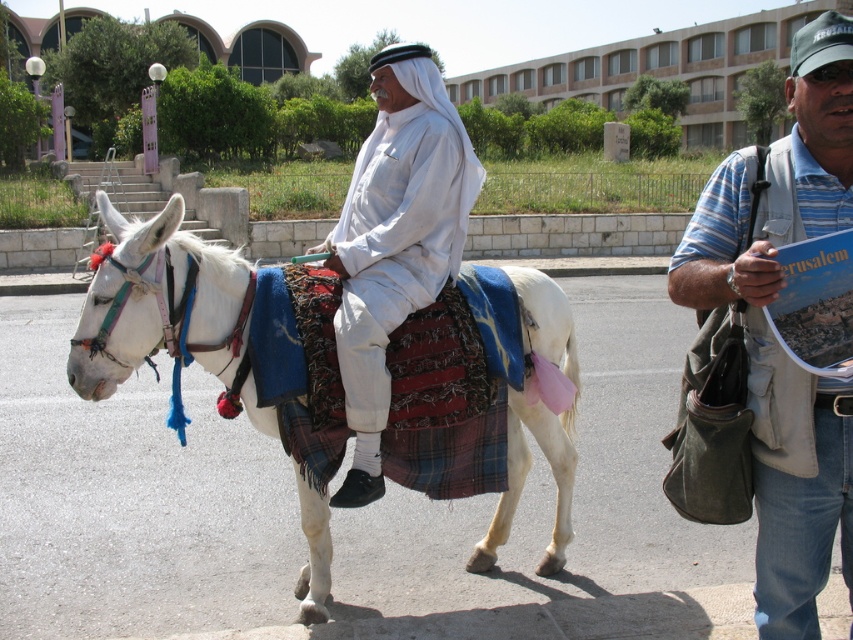
Question: Can you confirm if striped cotton shirt at right is positioned to the right of white cotton shirt at center?

Choices:
 (A) no
 (B) yes

Answer: (B)

Question: Which object is closer to the camera taking this photo?

Choices:
 (A) white cotton shirt at center
 (B) striped cotton shirt at right
 (C) white plaid saddle at center

Answer: (B)

Question: Does striped cotton shirt at right appear on the left side of white cotton shirt at center?

Choices:
 (A) yes
 (B) no

Answer: (B)

Question: Which object appears farthest from the camera in this image?

Choices:
 (A) white cotton shirt at center
 (B) white plaid saddle at center
 (C) striped cotton shirt at right

Answer: (B)

Question: Does striped cotton shirt at right come behind white cotton shirt at center?

Choices:
 (A) no
 (B) yes

Answer: (A)

Question: Which object is closer to the camera taking this photo?

Choices:
 (A) striped cotton shirt at right
 (B) white cotton shirt at center

Answer: (A)